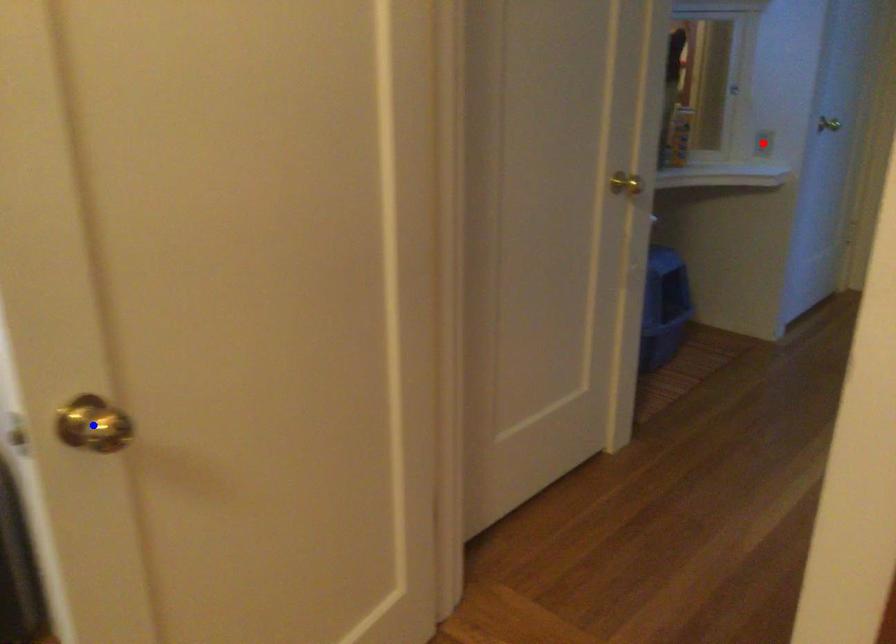
Question: Two points are marked on the image. Which point is closer to the camera?

Choices:
 (A) Blue point is closer.
 (B) Red point is closer.

Answer: (A)